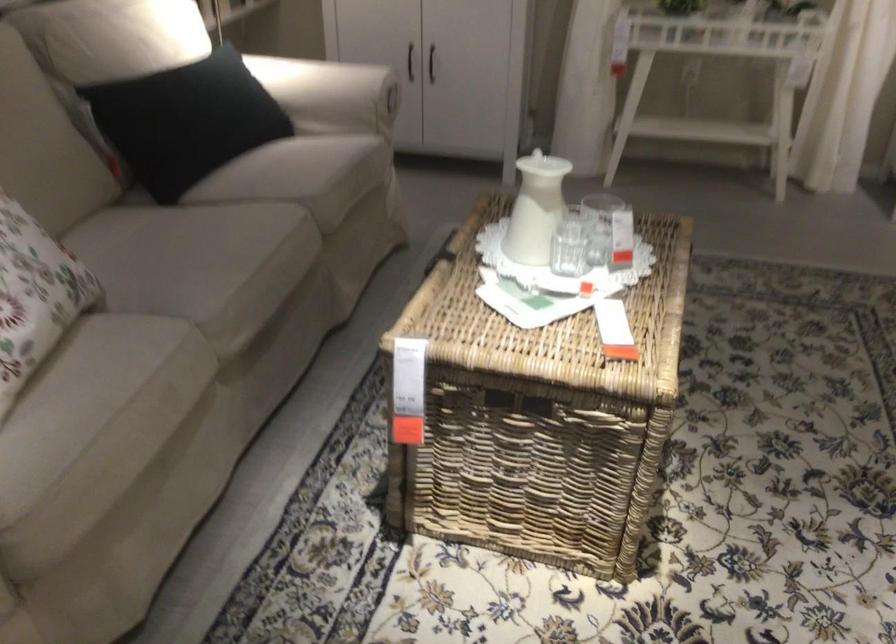
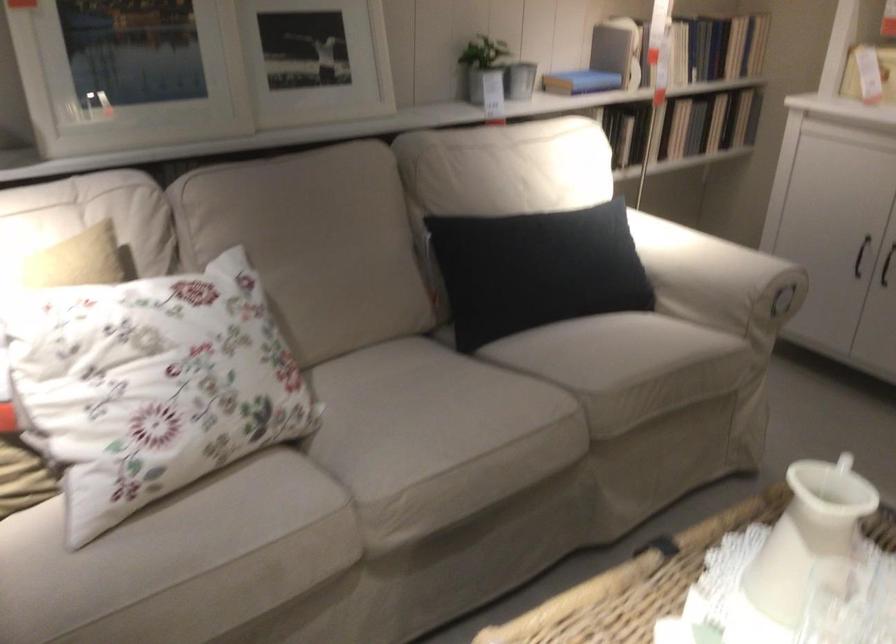
Locate, in the second image, the point that corresponds to [197,118] in the first image.

(536, 270)